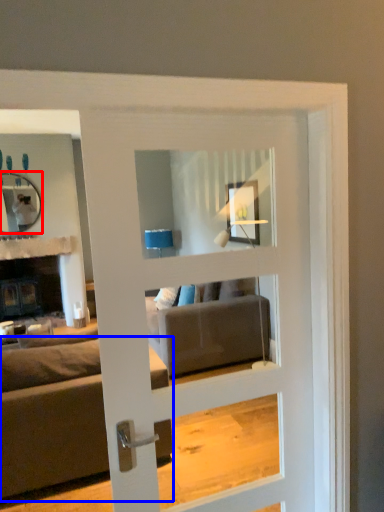
Question: Among these objects, which one is farthest to the camera, mirror (highlighted by a red box) or studio couch (highlighted by a blue box)?

Choices:
 (A) mirror
 (B) studio couch

Answer: (A)